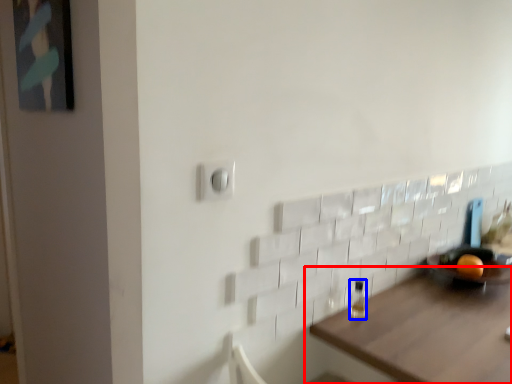
Question: Which point is further to the camera, table (highlighted by a red box) or bottle (highlighted by a blue box)?

Choices:
 (A) table
 (B) bottle

Answer: (B)